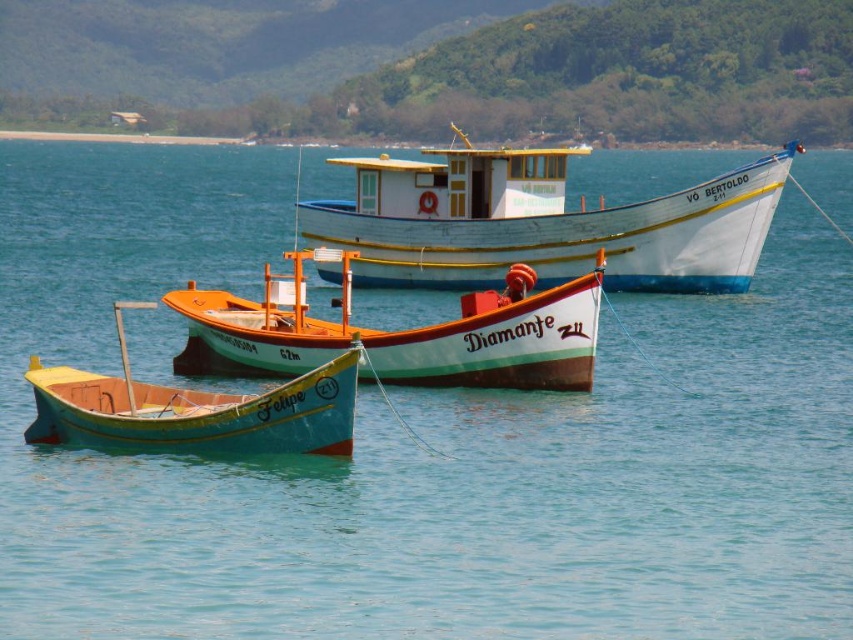
You are a marine biologist observing the coastal scene. You need to determine which boat is taller between the white wooden boat at center and the teal matte boat at center. Based on the scene, which one is taller?

The white wooden boat at center is taller than the teal matte boat at center according to the description.

Based on the photo, you are standing on the shore and see two points marked in the water. Which point is farther from you, point (x=373, y=212) or point (x=199, y=365)?

Point (x=373, y=212) is behind point (x=199, y=365), so it is farther from you.